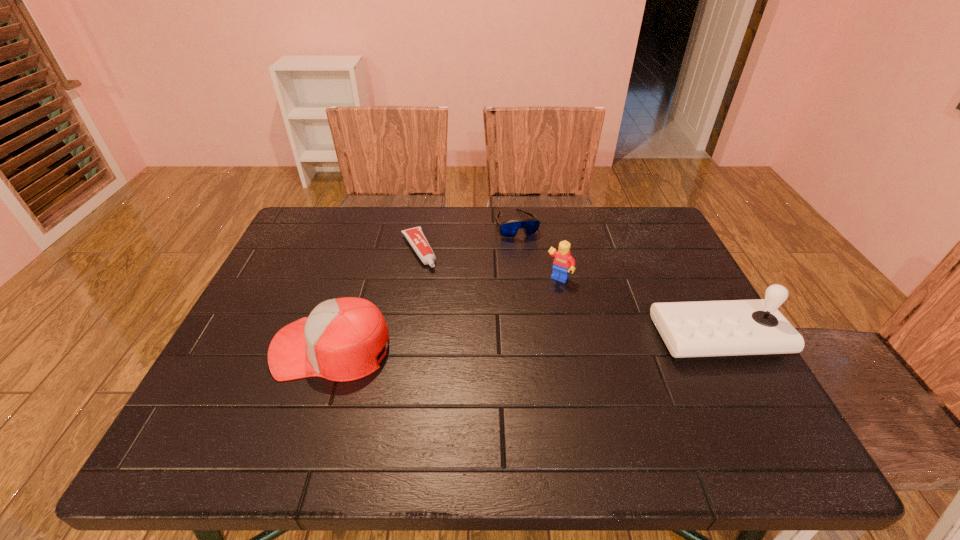
I want to click on free location located on the face of the third farthest object, so click(x=525, y=321).

The width and height of the screenshot is (960, 540). I want to click on free space located on the face of the third farthest object, so click(x=480, y=383).

Image resolution: width=960 pixels, height=540 pixels. Identify the location of vacant space located on the front-facing side of the sunglasses. (540, 281).

At what (x,y) coordinates should I click in order to perform the action: click on free location located 0.120m on the front-facing side of the sunglasses. Please return your answer as a coordinate pair (x, y). Image resolution: width=960 pixels, height=540 pixels. Looking at the image, I should click on (533, 265).

You are a GUI agent. You are given a task and a screenshot of the screen. Output one action in this format:
    pyautogui.click(x=<x>, y=<y>)
    Task: Click on the free space located on the front-facing side of the sunglasses
    
    Given the screenshot: What is the action you would take?
    pyautogui.click(x=549, y=302)

Identify the location of vacant space located 0.170m at the nozzle of the shortest object. (446, 309).

What are the coordinates of `vacant point located 0.120m at the nozzle of the shortest object` in the screenshot? It's located at (439, 297).

Find the location of a particular element. vacant area located 0.330m at the nozzle of the shortest object is located at coordinates (472, 355).

The image size is (960, 540). In order to click on sunglasses positioned at the far edge in this screenshot , I will do `click(508, 229)`.

This screenshot has width=960, height=540. Find the location of `toothpaste positioned at the far edge`. toothpaste positioned at the far edge is located at coordinates (415, 236).